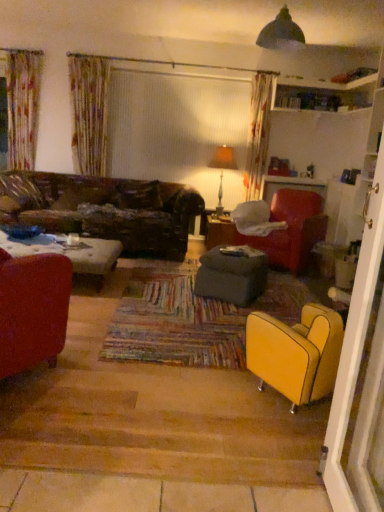
Question: From the image's perspective, does velvet red armchair at center-right, which is the first chair from right to left, appear lower than matte red armchair at left, the third chair from the back?

Choices:
 (A) no
 (B) yes

Answer: (A)

Question: Considering the relative positions of velvet red armchair at center-right, the third chair in the left-to-right sequence, and matte red armchair at left, positioned as the first chair in front-to-back order, in the image provided, is velvet red armchair at center-right, the third chair in the left-to-right sequence, to the left of matte red armchair at left, positioned as the first chair in front-to-back order, from the viewer's perspective?

Choices:
 (A) yes
 (B) no

Answer: (B)

Question: From the image's perspective, is velvet red armchair at center-right, which is the first chair from right to left, located above matte red armchair at left, placed as the third chair when sorted from right to left?

Choices:
 (A) no
 (B) yes

Answer: (B)

Question: Is velvet red armchair at center-right, the third chair in the left-to-right sequence, to the right of matte red armchair at left, the third chair from the back, from the viewer's perspective?

Choices:
 (A) no
 (B) yes

Answer: (B)

Question: Is velvet red armchair at center-right, which appears as the 1th chair when viewed from the back, not close to matte red armchair at left, positioned as the first chair in front-to-back order?

Choices:
 (A) yes
 (B) no

Answer: (A)

Question: Do you think matte brown table at center is within dark gray fabric ottoman at center, or outside of it?

Choices:
 (A) outside
 (B) inside

Answer: (A)

Question: Considering the positions of matte brown table at center and dark gray fabric ottoman at center in the image, is matte brown table at center wider or thinner than dark gray fabric ottoman at center?

Choices:
 (A) wide
 (B) thin

Answer: (A)

Question: From a real-world perspective, is matte brown table at center positioned above or below dark gray fabric ottoman at center?

Choices:
 (A) below
 (B) above

Answer: (A)

Question: Is point (226, 244) positioned closer to the camera than point (213, 289)?

Choices:
 (A) closer
 (B) farther

Answer: (B)

Question: In the image, is yellow leather armchair at lower right, which is the 2th chair in left-to-right order, positioned in front of or behind matte brown table at center?

Choices:
 (A) front
 (B) behind

Answer: (A)

Question: From their relative heights in the image, would you say yellow leather armchair at lower right, the 2th chair from the right, is taller or shorter than matte brown table at center?

Choices:
 (A) tall
 (B) short

Answer: (A)

Question: Is yellow leather armchair at lower right, the 2th chair from the right, to the left or to the right of matte brown table at center in the image?

Choices:
 (A) right
 (B) left

Answer: (A)

Question: Choose the correct answer: Is yellow leather armchair at lower right, which is the 2th chair in left-to-right order, inside matte brown table at center or outside it?

Choices:
 (A) inside
 (B) outside

Answer: (B)

Question: From a real-world perspective, is dark gray fabric ottoman at center positioned above or below matte brown table at center?

Choices:
 (A) below
 (B) above

Answer: (B)

Question: From their relative heights in the image, would you say dark gray fabric ottoman at center is taller or shorter than matte brown table at center?

Choices:
 (A) tall
 (B) short

Answer: (B)